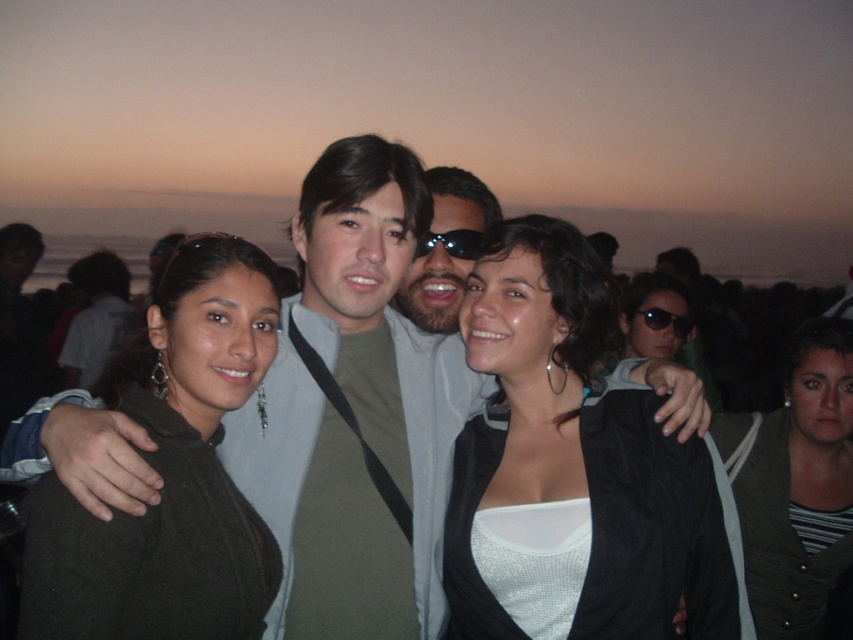
Question: Among these objects, which one is farthest from the camera?

Choices:
 (A) white matte jacket at center
 (B) striped fabric shirt at center
 (C) black plastic sunglasses at center

Answer: (C)

Question: Which of these objects is positioned closest to the matte black goggles at center?

Choices:
 (A) black plastic sunglasses at center
 (B) striped fabric shirt at center

Answer: (B)

Question: Is striped fabric shirt at center further to camera compared to black plastic sunglasses at center?

Choices:
 (A) yes
 (B) no

Answer: (B)

Question: Is white matte jacket at center below matte black goggles at center?

Choices:
 (A) no
 (B) yes

Answer: (B)

Question: Where is white matte jacket at center located in relation to dark green sweater at center in the image?

Choices:
 (A) right
 (B) left

Answer: (A)

Question: Which of the following is the farthest from the observer?

Choices:
 (A) matte green sweater at center
 (B) striped fabric shirt at center

Answer: (B)